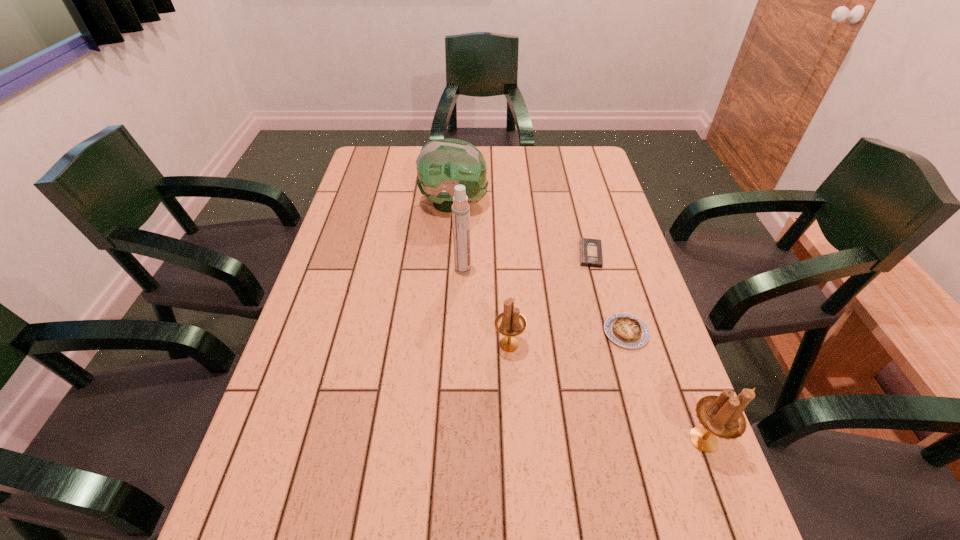
This screenshot has height=540, width=960. I want to click on vacant area that satisfies the following two spatial constraints: 1. on the back side of the shortest object; 2. on the left side of the fourth tallest object, so click(504, 254).

Find the location of a particular element. vacant space that satisfies the following two spatial constraints: 1. on the visor of the nearest object; 2. on the left side of the football helmet is located at coordinates (438, 440).